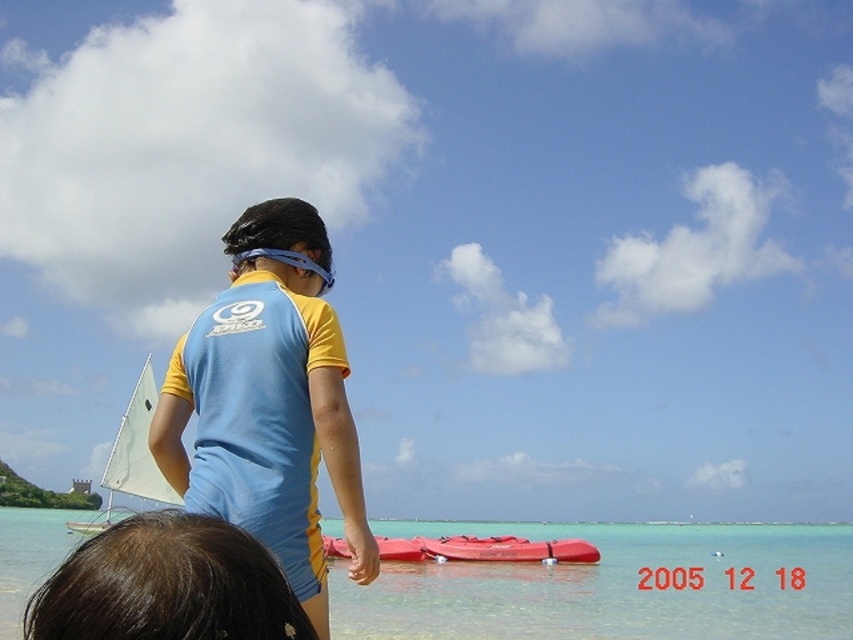
Which is in front, point (341, 548) or point (309, 259)?

Point (309, 259)

Is red rubber kayak at center below blue rubber goggles at upper center?

Yes, red rubber kayak at center is below blue rubber goggles at upper center.

Who is more distant from viewer, (376, 538) or (283, 250)?

Point (376, 538)

At what (x,y) coordinates should I click in order to perform the action: click on red rubber kayak at center. Please return your answer as a coordinate pair (x, y). The height and width of the screenshot is (640, 853). Looking at the image, I should click on (399, 548).

Does white matte sail at upper left appear over rubberized red kayak at center?

Yes, white matte sail at upper left is above rubberized red kayak at center.

Does point (125, 438) come farther from viewer compared to point (477, 541)?

Yes, point (125, 438) is behind point (477, 541).

Measure the distance between white matte sail at upper left and camera.

A distance of 61.69 meters exists between white matte sail at upper left and camera.

Where is `white matte sail at upper left`? The width and height of the screenshot is (853, 640). white matte sail at upper left is located at coordinates (132, 458).

Where is `clear water at lower center`? The height and width of the screenshot is (640, 853). clear water at lower center is located at coordinates (608, 586).

Between point (386, 588) and point (126, 452), which one is positioned in front?

Point (386, 588) is in front.

What do you see at coordinates (608, 586) in the screenshot? The image size is (853, 640). I see `clear water at lower center` at bounding box center [608, 586].

Where is `clear water at lower center`? Image resolution: width=853 pixels, height=640 pixels. clear water at lower center is located at coordinates (608, 586).